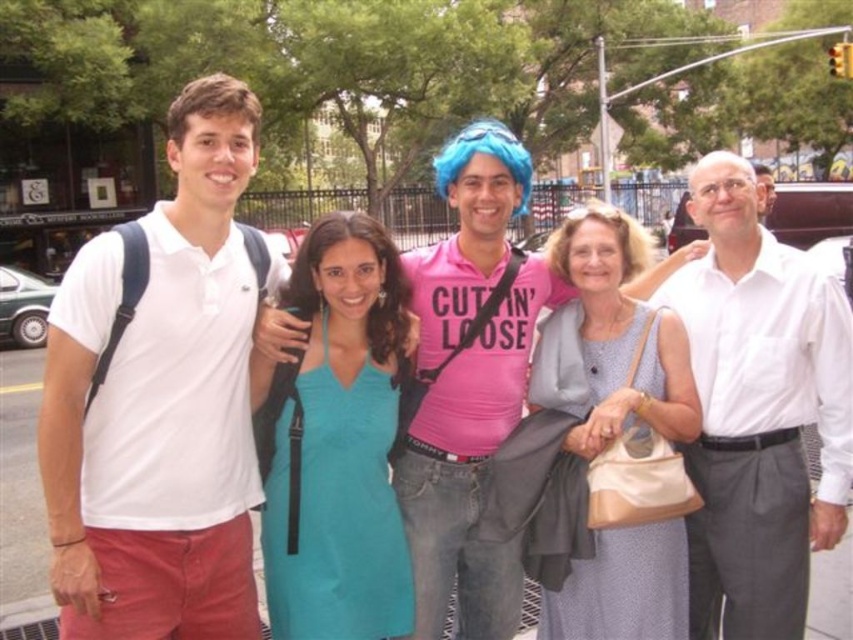
You are a fashion designer observing the group of people in the image. You need to determine which clothing item is shorter in height between the white cotton polo shirt at left and the white cotton shirt at right. Which one is shorter?

The white cotton polo shirt at left is shorter in height compared to the white cotton shirt at right.